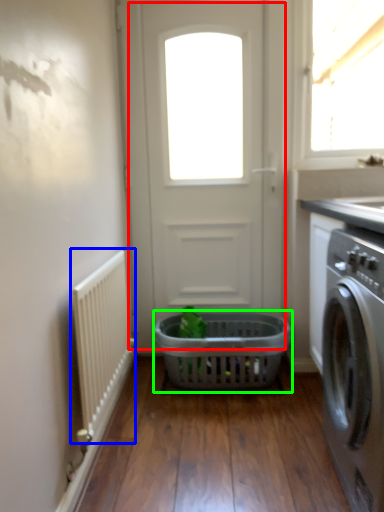
Question: Considering the real-world distances, which object is closest to door (highlighted by a red box)? radiator (highlighted by a blue box) or basket (highlighted by a green box).

Choices:
 (A) radiator
 (B) basket

Answer: (B)